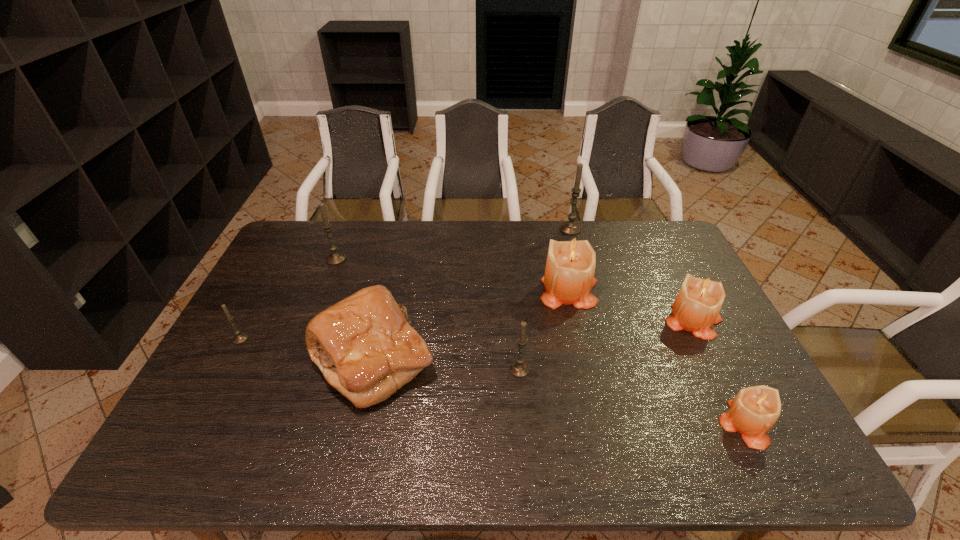
You are a GUI agent. You are given a task and a screenshot of the screen. Output one action in this format:
    pyautogui.click(x=<x>, y=<y>)
    Task: Click on the vacant space positioned 0.290m on the right of the third farthest gray candle
    
    Given the screenshot: What is the action you would take?
    pyautogui.click(x=350, y=339)

At what (x,y) coordinates should I click in order to perform the action: click on vacant area situated 0.130m on the back of the nearest beige candle. Please return your answer as a coordinate pair (x, y). The height and width of the screenshot is (540, 960). Looking at the image, I should click on (711, 358).

Locate an element on the screen. The image size is (960, 540). object located at the near edge is located at coordinates (753, 412).

This screenshot has width=960, height=540. What are the coordinates of `object situated at the left edge` in the screenshot? It's located at (239, 338).

You are a GUI agent. You are given a task and a screenshot of the screen. Output one action in this format:
    pyautogui.click(x=<x>, y=<y>)
    Task: Click on the object that is positioned at the near right corner
    This screenshot has height=540, width=960.
    Given the screenshot: What is the action you would take?
    pyautogui.click(x=753, y=412)

You are a GUI agent. You are given a task and a screenshot of the screen. Output one action in this format:
    pyautogui.click(x=<x>, y=<y>)
    Task: Click on the blank space at the far edge of the desktop
    
    Given the screenshot: What is the action you would take?
    pyautogui.click(x=333, y=231)

The width and height of the screenshot is (960, 540). In the image, there is a desktop. What are the coordinates of `vacant area at the near edge` in the screenshot? It's located at (659, 434).

Find the location of a particular element. vacant space at the left edge is located at coordinates (282, 341).

I want to click on blank space at the far left corner of the desktop, so click(288, 237).

Where is `free spot at the near left corner of the desktop`? The height and width of the screenshot is (540, 960). free spot at the near left corner of the desktop is located at coordinates (207, 442).